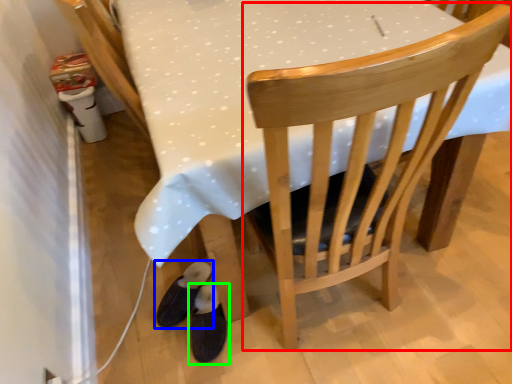
Question: Which object is positioned closest to chair (highlighted by a red box)? Select from footwear (highlighted by a blue box) and footwear (highlighted by a green box).

Choices:
 (A) footwear
 (B) footwear

Answer: (B)